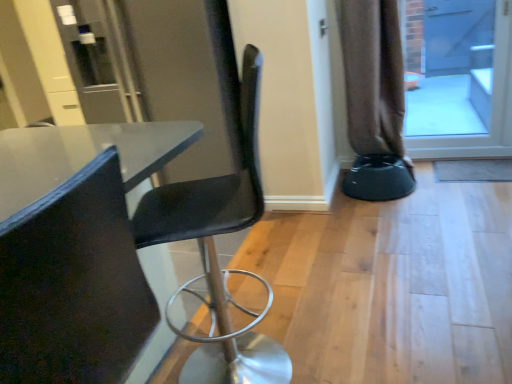
The width and height of the screenshot is (512, 384). I want to click on vacant space to the right of matte black chair at center, which is the second chair in front-to-back order, so click(359, 327).